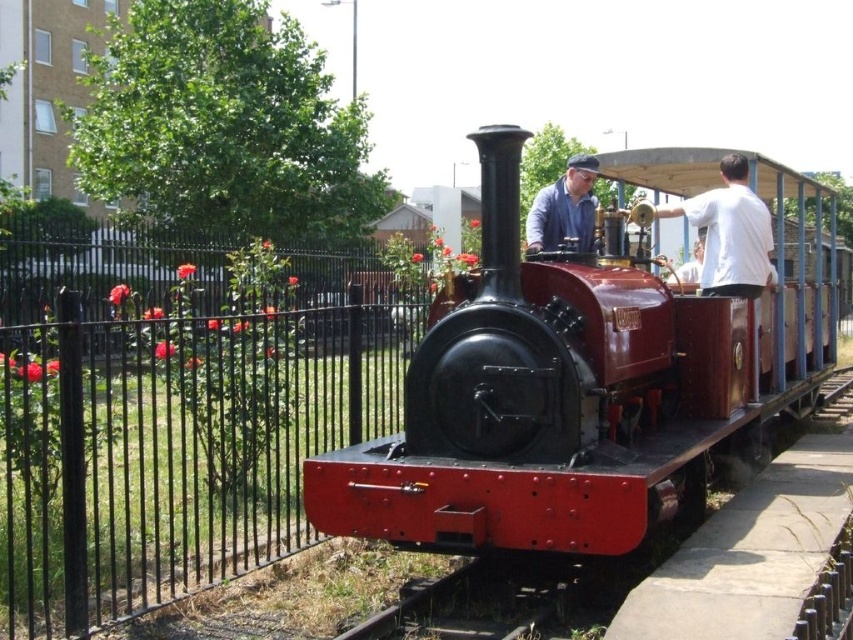
You are a photographer planning to take a photo of the black metal fence at left and the white cotton shirt at upper right. Based on their positions, which object would appear closer to the camera in the final photo?

The white cotton shirt at upper right appears closer to the camera because the black metal fence at left is positioned under it, indicating it is farther away.

You are standing at the point with coordinates [581,380] in the image. What object are you likely standing on?

The point [581,380] is on the shiny red locomotive at center.

You are a photographer planning to take a picture of the shiny red locomotive at center and the black metal train track at lower center. Which object will appear narrower in the photo?

The shiny red locomotive at center will appear narrower in the photo because it is thinner than the black metal train track at lower center.